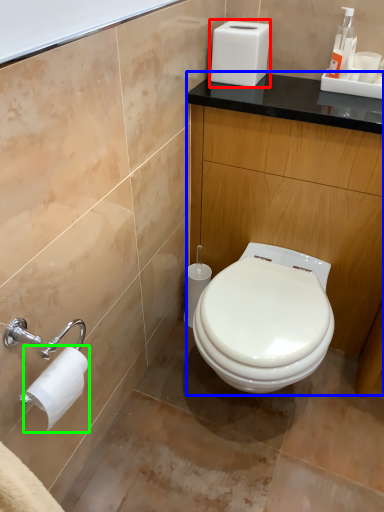
Question: Estimate the real-world distances between objects in this image. Which object is farther from appliance (highlighted by a red box), counter (highlighted by a blue box) or toilet paper (highlighted by a green box)?

Choices:
 (A) counter
 (B) toilet paper

Answer: (B)